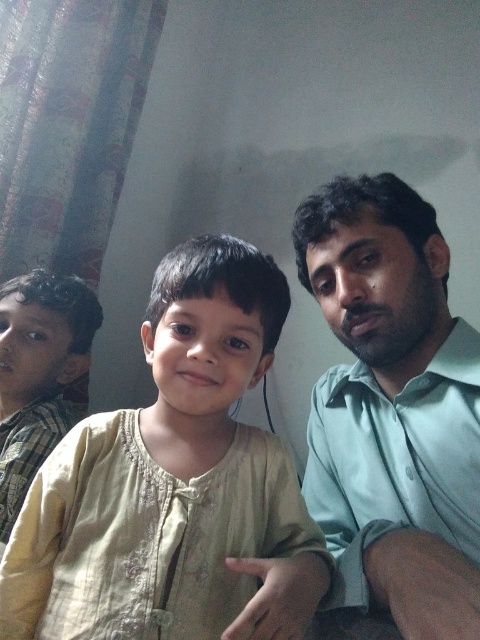
Question: Can you confirm if green matte shirt at right is positioned to the left of light brown plaid shirt at left?

Choices:
 (A) yes
 (B) no

Answer: (B)

Question: Which is nearer to the light beige fabric at center?

Choices:
 (A) light brown plaid shirt at left
 (B) green matte shirt at right

Answer: (B)

Question: Does light beige fabric at center appear over light brown plaid shirt at left?

Choices:
 (A) no
 (B) yes

Answer: (B)

Question: Among these points, which one is nearest to the camera?

Choices:
 (A) (316, 228)
 (B) (208, 529)
 (C) (71, 324)

Answer: (B)

Question: Can you confirm if light beige fabric at center is positioned below green matte shirt at right?

Choices:
 (A) no
 (B) yes

Answer: (B)

Question: Which of these objects is positioned closest to the light beige fabric at center?

Choices:
 (A) light brown plaid shirt at left
 (B) green matte shirt at right

Answer: (B)